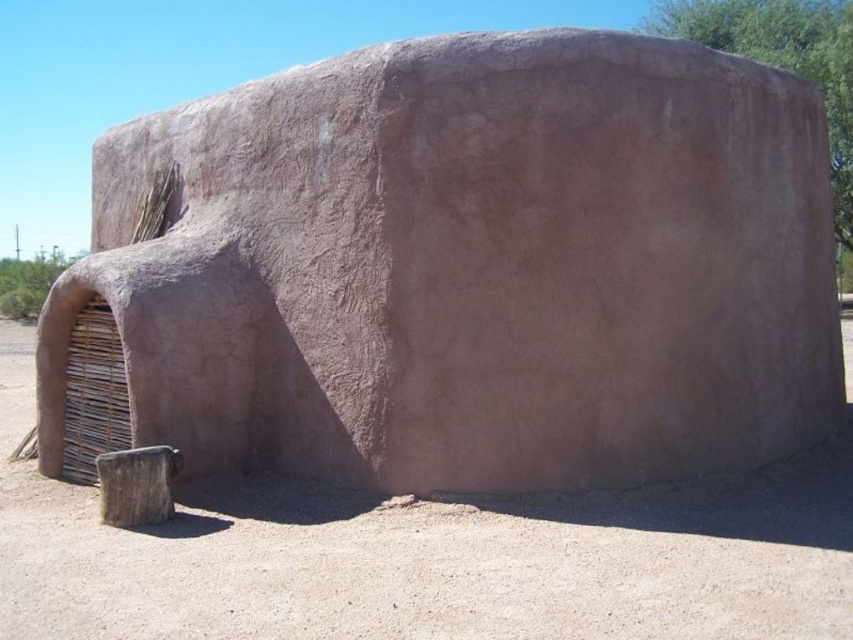
You are an architect designing a new outdoor space and want to place the brown clay structure at center and the brown rough wood stump at lower left in a way that they are both visible but not too crowded. Given their sizes, which object should you place closer to the entrance to ensure there is enough space?

The brown clay structure at center should be placed closer to the entrance since it occupies less space than the brown rough wood stump at lower left, allowing for better spacing and visibility between the two objects.

You are standing in front of the brown clay structure at center and the brown rough wood stump at lower left. Which object is taller?

The brown clay structure at center is taller than the brown rough wood stump at lower left.